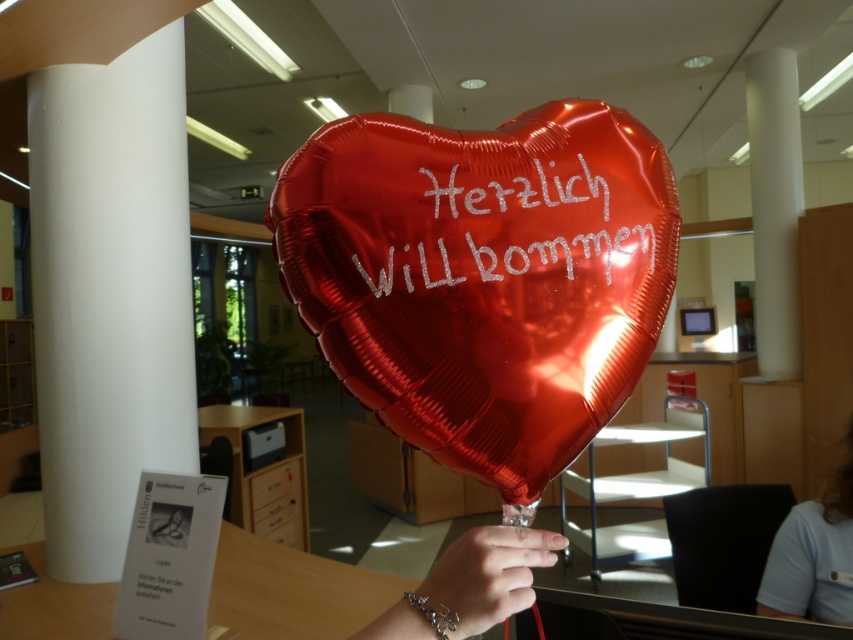
Question: Can you confirm if shiny metallic heart at center is bigger than white fabric shirt at lower right?

Choices:
 (A) no
 (B) yes

Answer: (A)

Question: Which object appears closest to the camera in this image?

Choices:
 (A) shiny metallic heart at center
 (B) white smooth pillar at left
 (C) white fabric shirt at lower right

Answer: (A)

Question: Estimate the real-world distances between objects in this image. Which object is farther from the shiny metallic heart at center?

Choices:
 (A) metallic silver bracelet at lower center
 (B) white fabric shirt at lower right

Answer: (B)

Question: From the image, what is the correct spatial relationship of white smooth pillar at left in relation to metallic silver bracelet at lower center?

Choices:
 (A) left
 (B) right

Answer: (A)

Question: Can you confirm if white smooth pillar at left is positioned below white smooth pillar at right?

Choices:
 (A) yes
 (B) no

Answer: (A)

Question: Among these objects, which one is farthest from the camera?

Choices:
 (A) white smooth pillar at right
 (B) shiny metallic heart at center
 (C) white smooth pillar at left
 (D) white fabric shirt at lower right

Answer: (A)